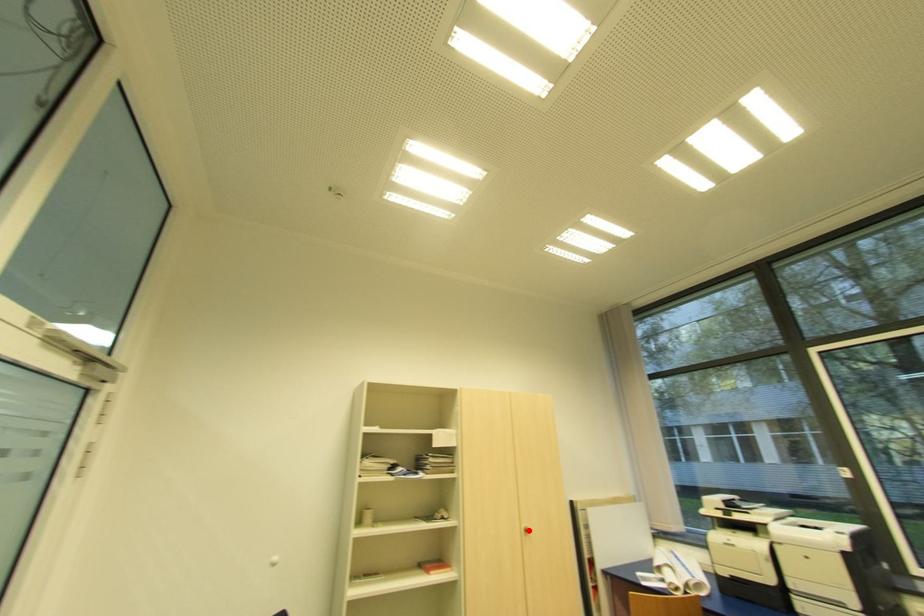
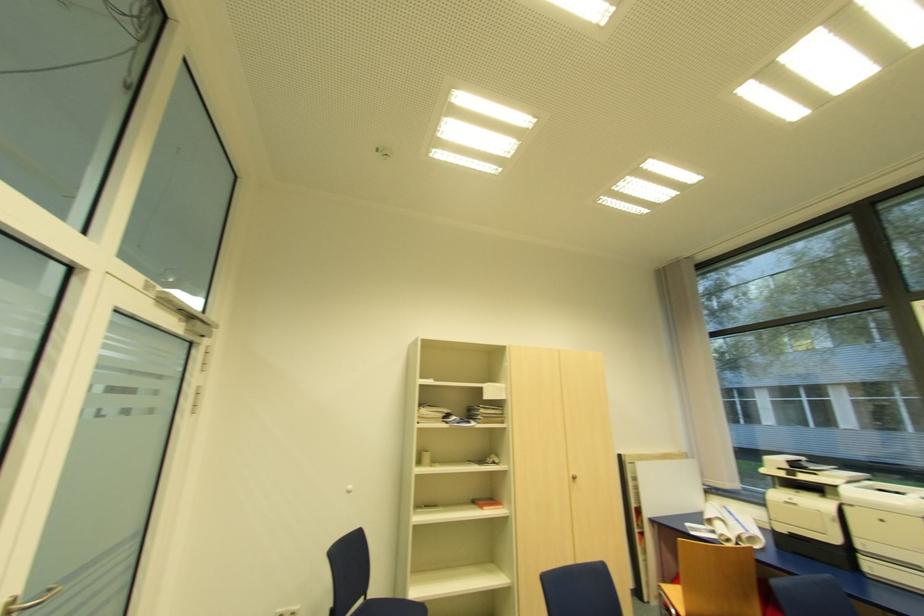
The point at the highlighted location is marked in the first image. Where is the corresponding point in the second image?

(576, 477)